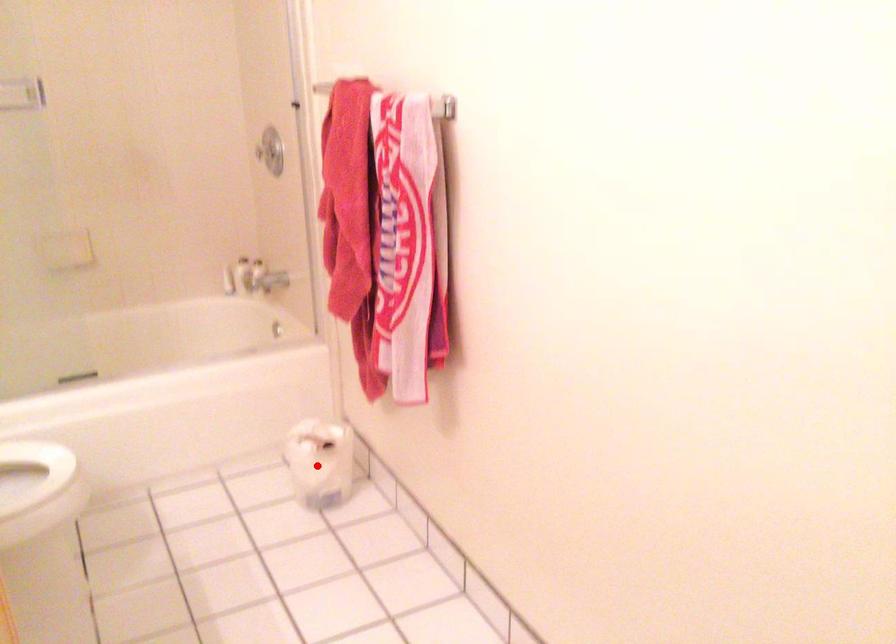
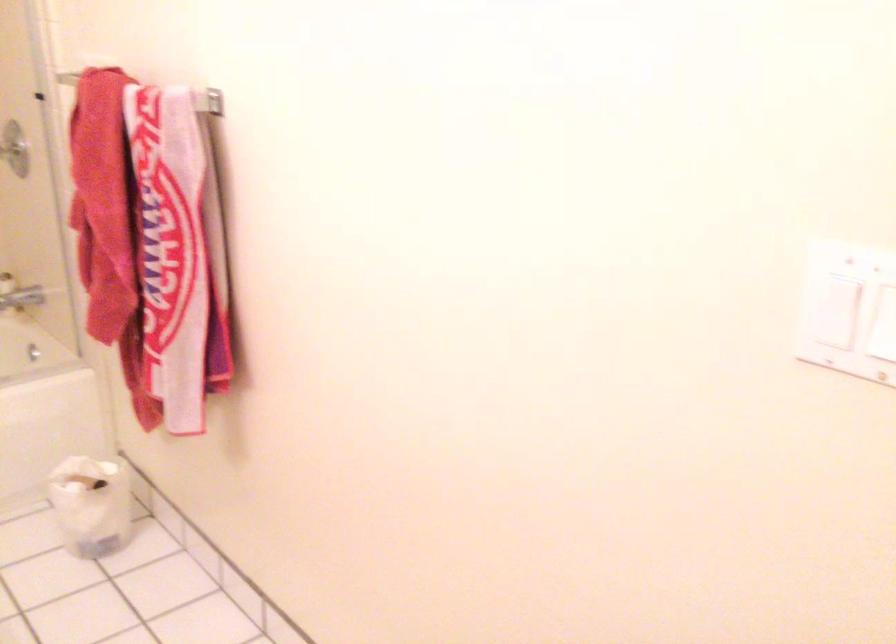
Question: I am providing you with two images of the same scene from different viewpoints. Image1 has a red point marked. In image2, the corresponding 3D location appears at what relative position? Reply with the corresponding letter.

Choices:
 (A) Closer
 (B) Farther

Answer: (A)